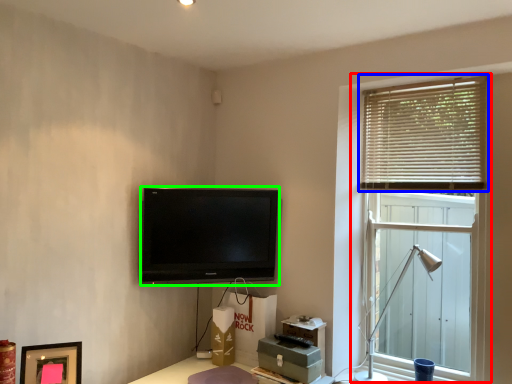
Question: Which object is the farthest from window (highlighted by a red box)? Choose among these: window blind (highlighted by a blue box) or television (highlighted by a green box).

Choices:
 (A) window blind
 (B) television

Answer: (B)